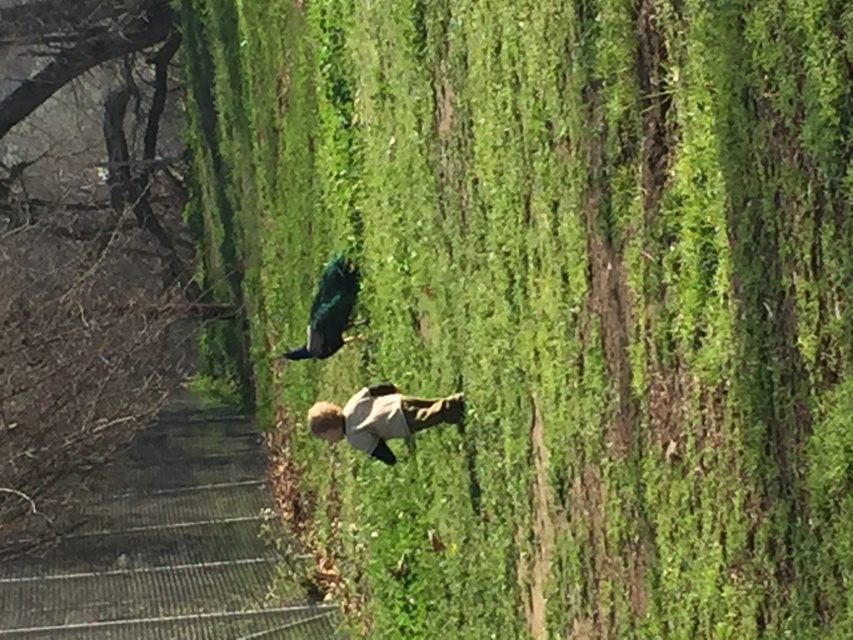
You are standing at the edge of the path and see the metallic fence at lower left and the light beige cotton pants at center. Which object is closer to your left side?

The metallic fence at lower left is positioned on the left side of light beige cotton pants at center, so it is closer to your left side.

You are a farmer checking the crops and notice the metallic fence at lower left and the light beige cotton pants at center. Which object is wider?

The metallic fence at lower left is wider than the light beige cotton pants at center.